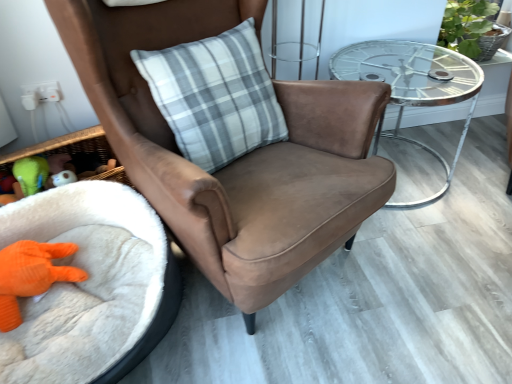
Question: Is the depth of white fluffy infant bed at lower left less than that of gray plaid pillow at center?

Choices:
 (A) yes
 (B) no

Answer: (A)

Question: From a real-world perspective, is white fluffy infant bed at lower left located higher than gray plaid pillow at center?

Choices:
 (A) no
 (B) yes

Answer: (A)

Question: Could you tell me if white fluffy infant bed at lower left is facing gray plaid pillow at center?

Choices:
 (A) yes
 (B) no

Answer: (B)

Question: Is white fluffy infant bed at lower left wider than gray plaid pillow at center?

Choices:
 (A) no
 (B) yes

Answer: (B)

Question: Are white fluffy infant bed at lower left and gray plaid pillow at center located far from each other?

Choices:
 (A) yes
 (B) no

Answer: (B)

Question: Looking at the image, does green rubber duck at lower left, the 1th toy when ordered from top to bottom, seem bigger or smaller compared to green leafy plant at upper right?

Choices:
 (A) small
 (B) big

Answer: (A)

Question: Is green rubber duck at lower left, the 1th toy when ordered from top to bottom, situated inside green leafy plant at upper right or outside?

Choices:
 (A) inside
 (B) outside

Answer: (B)

Question: Is green rubber duck at lower left, placed as the second toy when sorted from bottom to top, in front of or behind green leafy plant at upper right in the image?

Choices:
 (A) front
 (B) behind

Answer: (A)

Question: From a real-world perspective, is green rubber duck at lower left, placed as the second toy when sorted from bottom to top, above or below green leafy plant at upper right?

Choices:
 (A) below
 (B) above

Answer: (A)

Question: Is gray plaid pillow at center inside or outside of white fluffy infant bed at lower left?

Choices:
 (A) inside
 (B) outside

Answer: (B)

Question: Looking at the image, does gray plaid pillow at center seem bigger or smaller compared to white fluffy infant bed at lower left?

Choices:
 (A) big
 (B) small

Answer: (B)

Question: Relative to white fluffy infant bed at lower left, is gray plaid pillow at center in front or behind?

Choices:
 (A) behind
 (B) front

Answer: (A)

Question: Considering the relative positions of gray plaid pillow at center and white fluffy infant bed at lower left in the image provided, is gray plaid pillow at center to the left or to the right of white fluffy infant bed at lower left?

Choices:
 (A) left
 (B) right

Answer: (B)

Question: From the image's perspective, is orange knitted toy at lower left, the first toy in the bottom-to-top sequence, located above or below gray plaid pillow at center?

Choices:
 (A) above
 (B) below

Answer: (B)

Question: From a real-world perspective, relative to gray plaid pillow at center, is orange knitted toy at lower left, the first toy in the bottom-to-top sequence, vertically above or below?

Choices:
 (A) above
 (B) below

Answer: (B)